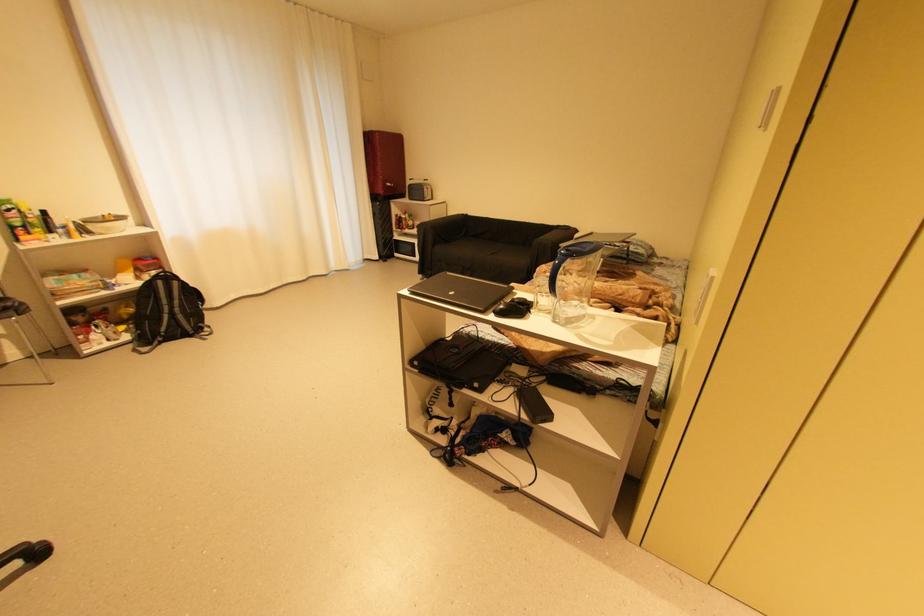
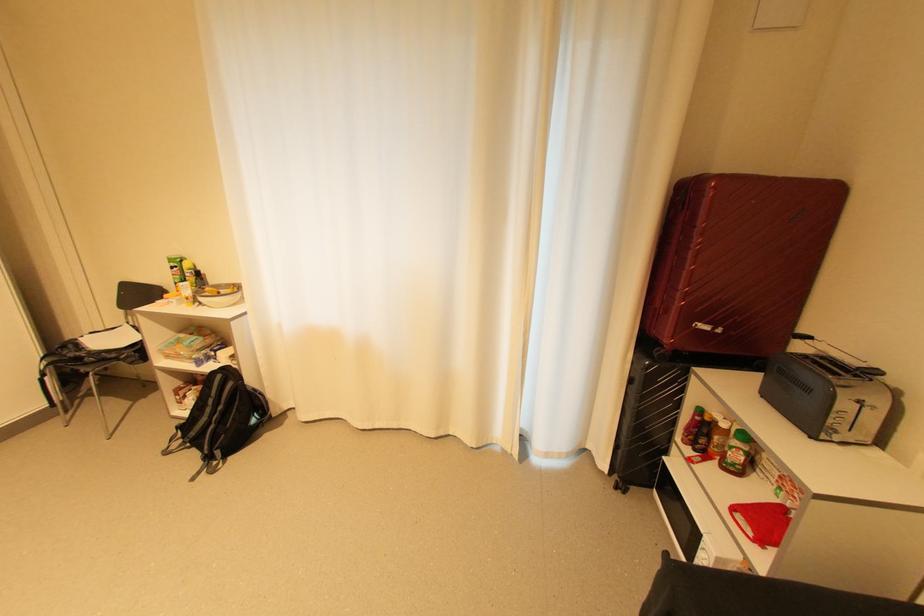
The point at (419,225) is marked in the first image. Where is the corresponding point in the second image?

(739, 466)